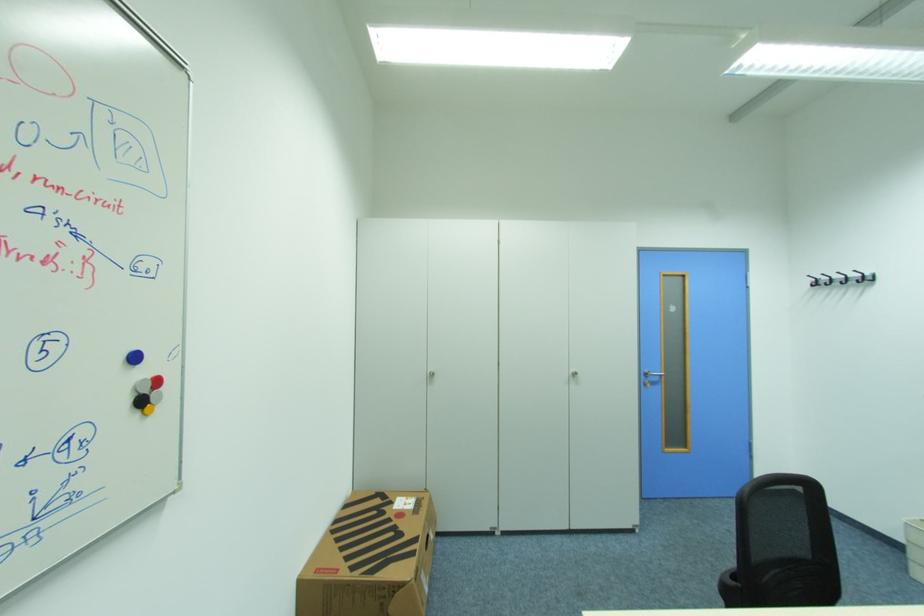
Where would you sit the chair sitting surface? Please return your answer as a coordinate pair (x, y).

(755, 578)